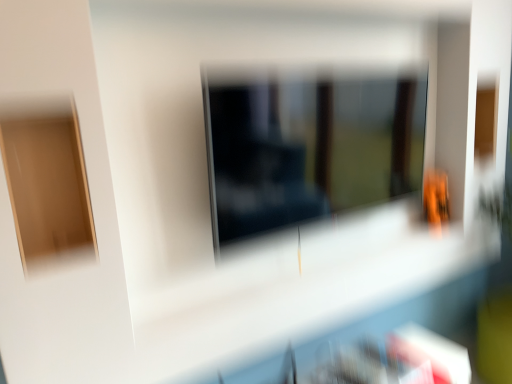
Find the location of a particular element. The image size is (512, 384). transparent glass window at center is located at coordinates (308, 148).

This screenshot has height=384, width=512. Describe the element at coordinates (308, 148) in the screenshot. I see `transparent glass window at center` at that location.

Identify the location of transparent glass window at center. (308, 148).